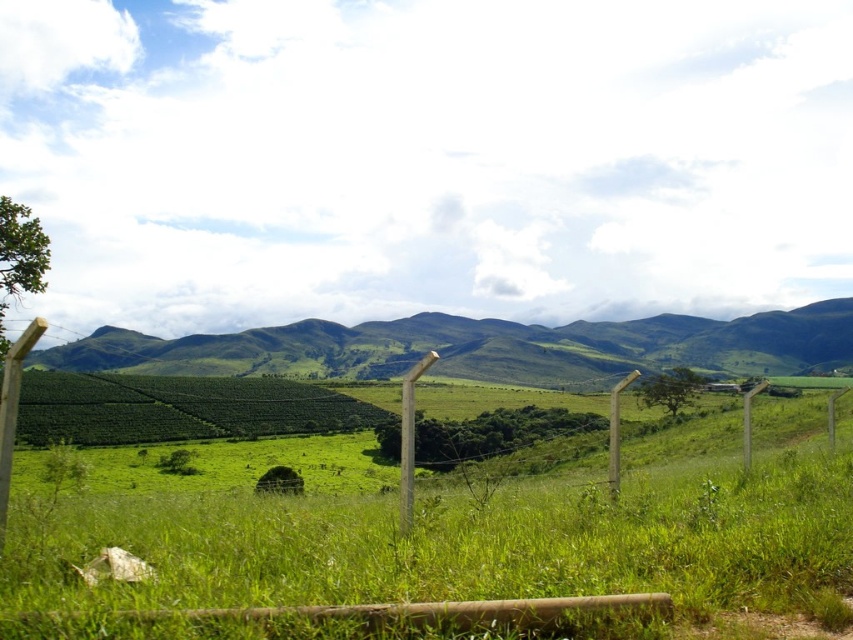
Question: Can you confirm if green grassy field at center is bigger than green grassy hill at center?

Choices:
 (A) no
 (B) yes

Answer: (A)

Question: Among these points, which one is farthest from the camera?

Choices:
 (A) tap(837, 324)
 (B) tap(51, 540)
 (C) tap(0, 518)

Answer: (A)

Question: Is green grassy field at center behind green grassy hill at center?

Choices:
 (A) no
 (B) yes

Answer: (A)

Question: Which point appears closest to the camera in this image?

Choices:
 (A) (735, 484)
 (B) (606, 337)

Answer: (A)

Question: Which point is closer to the camera?

Choices:
 (A) click(x=193, y=333)
 (B) click(x=0, y=451)
 (C) click(x=410, y=444)
 (D) click(x=202, y=625)

Answer: (D)

Question: Does wooden post at left have a lesser width compared to smooth wood post at center?

Choices:
 (A) yes
 (B) no

Answer: (A)